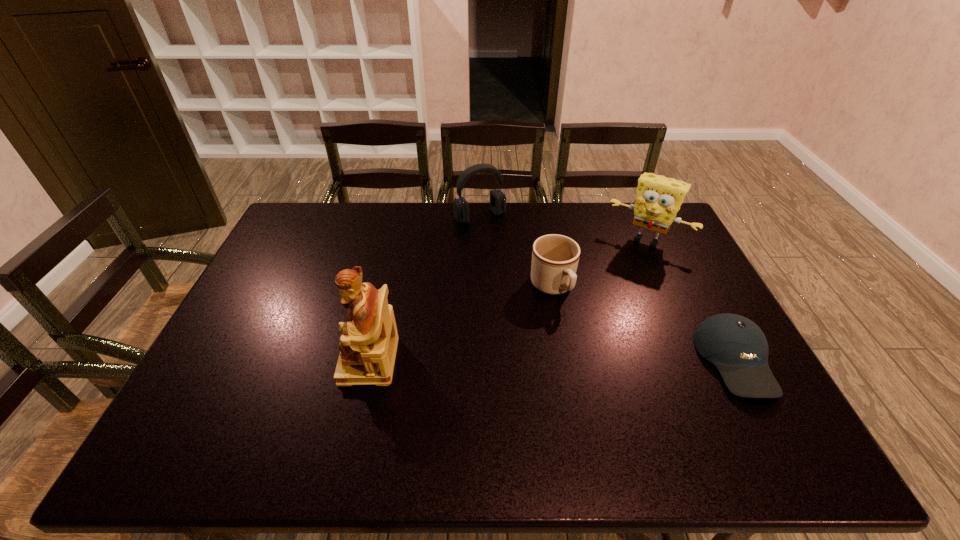
Locate an element on the screen. vacant space on the desktop that is between the figurine and the shortest object and is positioned on the side of the fourth tallest object with the handle is located at coordinates (602, 360).

You are a GUI agent. You are given a task and a screenshot of the screen. Output one action in this format:
    pyautogui.click(x=<x>, y=<y>)
    Task: Click on the vacant spot on the desktop that is between the tallest object and the shortest object and is positioned on the headband of the fourth object from right to left
    Image resolution: width=960 pixels, height=540 pixels.
    Given the screenshot: What is the action you would take?
    pyautogui.click(x=587, y=360)

What are the coordinates of `free space on the desktop that is between the tallest object and the shortest object and is positioned on the face of the sponge` in the screenshot? It's located at (581, 360).